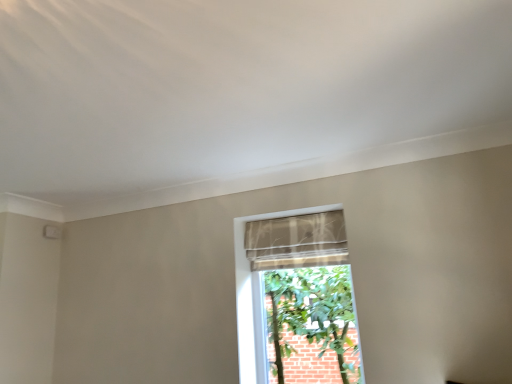
Question: Is beige textured fabric at center inside sheer fabric curtain at center?

Choices:
 (A) yes
 (B) no

Answer: (B)

Question: From a real-world perspective, does sheer fabric curtain at center sit lower than beige textured fabric at center?

Choices:
 (A) no
 (B) yes

Answer: (A)

Question: Is sheer fabric curtain at center positioned beyond the bounds of beige textured fabric at center?

Choices:
 (A) no
 (B) yes

Answer: (A)

Question: From a real-world perspective, is sheer fabric curtain at center positioned over beige textured fabric at center based on gravity?

Choices:
 (A) yes
 (B) no

Answer: (A)

Question: Does sheer fabric curtain at center have a smaller size compared to beige textured fabric at center?

Choices:
 (A) no
 (B) yes

Answer: (B)

Question: From the image's perspective, does sheer fabric curtain at center appear lower than beige textured fabric at center?

Choices:
 (A) no
 (B) yes

Answer: (A)

Question: Is beige textured fabric at center located outside sheer fabric curtain at center?

Choices:
 (A) no
 (B) yes

Answer: (B)

Question: Does beige textured fabric at center lie behind sheer fabric curtain at center?

Choices:
 (A) no
 (B) yes

Answer: (A)

Question: Is beige textured fabric at center next to sheer fabric curtain at center and touching it?

Choices:
 (A) no
 (B) yes

Answer: (A)

Question: Considering the relative positions of beige textured fabric at center and sheer fabric curtain at center in the image provided, is beige textured fabric at center to the left of sheer fabric curtain at center from the viewer's perspective?

Choices:
 (A) no
 (B) yes

Answer: (A)

Question: From the image's perspective, is beige textured fabric at center beneath sheer fabric curtain at center?

Choices:
 (A) no
 (B) yes

Answer: (B)

Question: Can you confirm if beige textured fabric at center is smaller than sheer fabric curtain at center?

Choices:
 (A) yes
 (B) no

Answer: (B)

Question: Is beige textured fabric at center inside the boundaries of sheer fabric curtain at center, or outside?

Choices:
 (A) outside
 (B) inside

Answer: (A)